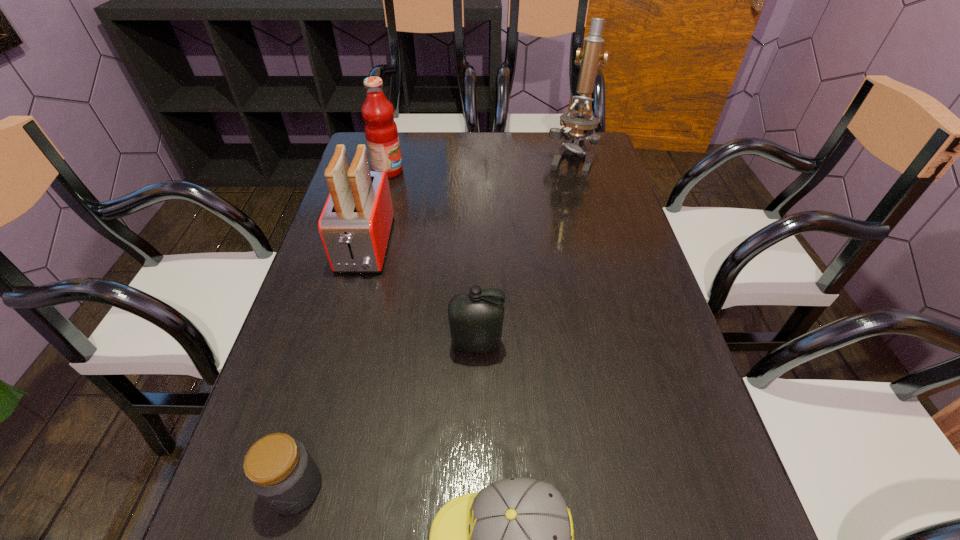
You are a GUI agent. You are given a task and a screenshot of the screen. Output one action in this format:
    pyautogui.click(x=<x>, y=<y>)
    Task: Click on the object that stands as the third closest to the baseball cap
    This screenshot has height=540, width=960.
    Given the screenshot: What is the action you would take?
    pyautogui.click(x=355, y=225)

This screenshot has height=540, width=960. What are the coordinates of `object that is the second closest to the toaster` in the screenshot? It's located at (476, 318).